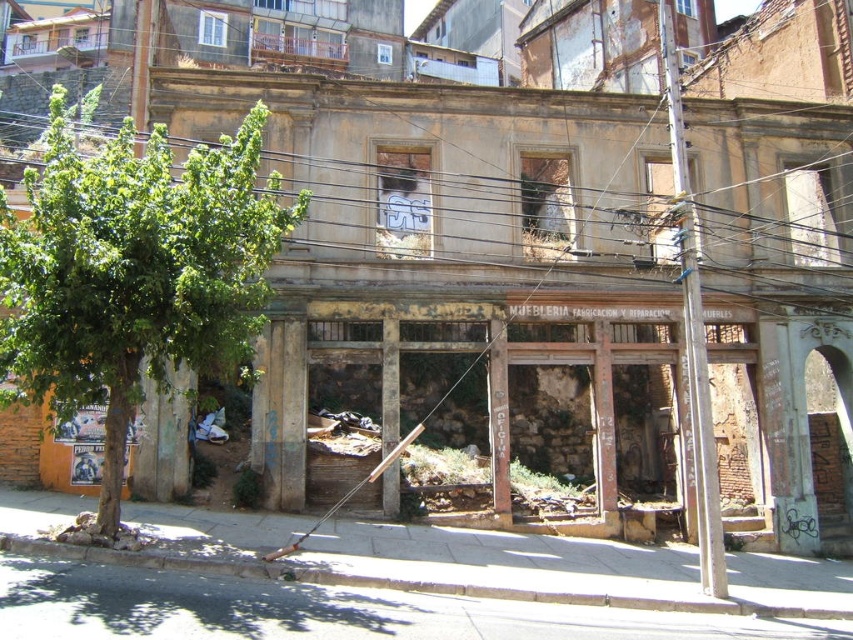
Based on the photo, you are a city planner assessing the building for renovation. You notice the brown wooden power line at upper center and the green leafy tree at left. Which object might pose a greater obstruction during the renovation work due to its size?

The brown wooden power line at upper center has a larger size compared to the green leafy tree at left, so it might pose a greater obstruction during the renovation work.

You are a painter hired to paint the facade of the building. You notice the brown wooden power line at upper center and the green leafy tree at left. Which object is closer to you as you stand in front of the building?

The brown wooden power line at upper center is closer to you because the green leafy tree at left is behind it.

From the picture: You are a city planner assessing the building for renovation. You notice the brown wooden power line at upper center and the green leafy tree at left. Which object is shorter in height?

The brown wooden power line at upper center is not as tall as the green leafy tree at left, so the brown wooden power line at upper center is shorter in height.